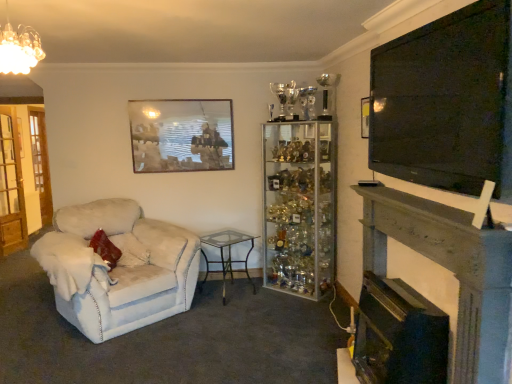
Question: Is velvet beige armchair at left wider or thinner than black glossy fireplace at lower right, placed as the second fireplace when sorted from right to left?

Choices:
 (A) wide
 (B) thin

Answer: (A)

Question: Based on their sizes in the image, would you say velvet beige armchair at left is bigger or smaller than black glossy fireplace at lower right, arranged as the first fireplace when viewed from the left?

Choices:
 (A) small
 (B) big

Answer: (B)

Question: Which object is the closest to the wooden glass door at left, which appears as the second glass door when viewed from the left?

Choices:
 (A) velvet beige armchair at left
 (B) metallic gold picture frame at upper right, which ranks as the 2th picture frame in back-to-front order
 (C) clear glass table at center
 (D) wooden mantel at right, the second fireplace viewed from the left
 (E) wooden glass door at left, which is counted as the 1th glass door, starting from the left

Answer: (E)

Question: Which is farther from the wooden glass door at left, which is counted as the 1th glass door, starting from the left?

Choices:
 (A) clear glass table at center
 (B) wooden glass door at left, positioned as the 1th glass door in right-to-left order
 (C) wooden picture frame at upper center, which is the second picture frame from front to back
 (D) black glossy fireplace at lower right, placed as the second fireplace when sorted from right to left
 (E) metallic gold picture frame at upper right, which appears as the 2th picture frame when viewed from the left

Answer: (D)